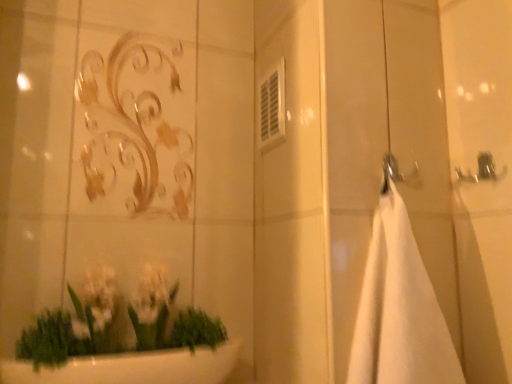
Question: Is white glossy plant at lower left turned away from white matte towel at right?

Choices:
 (A) no
 (B) yes

Answer: (A)

Question: Is there a large distance between white glossy plant at lower left and white matte towel at right?

Choices:
 (A) no
 (B) yes

Answer: (A)

Question: Does white glossy plant at lower left have a smaller size compared to white matte towel at right?

Choices:
 (A) no
 (B) yes

Answer: (A)

Question: Is white glossy plant at lower left further to the viewer compared to white matte towel at right?

Choices:
 (A) yes
 (B) no

Answer: (A)

Question: Is white glossy plant at lower left positioned before white matte towel at right?

Choices:
 (A) no
 (B) yes

Answer: (A)

Question: Is white glossy plant at lower left to the right of white matte towel at right from the viewer's perspective?

Choices:
 (A) yes
 (B) no

Answer: (B)

Question: Is white matte towel at right oriented towards white glossy plant at lower left?

Choices:
 (A) no
 (B) yes

Answer: (A)

Question: Considering the relative sizes of white matte towel at right and white glossy plant at lower left in the image provided, is white matte towel at right bigger than white glossy plant at lower left?

Choices:
 (A) no
 (B) yes

Answer: (A)

Question: Is white matte towel at right oriented away from white glossy plant at lower left?

Choices:
 (A) yes
 (B) no

Answer: (B)

Question: From a real-world perspective, does white matte towel at right sit lower than white glossy plant at lower left?

Choices:
 (A) no
 (B) yes

Answer: (A)

Question: Considering the relative sizes of white matte towel at right and white glossy plant at lower left in the image provided, is white matte towel at right shorter than white glossy plant at lower left?

Choices:
 (A) yes
 (B) no

Answer: (B)

Question: Does white matte towel at right lie in front of white glossy plant at lower left?

Choices:
 (A) yes
 (B) no

Answer: (A)

Question: Relative to white glossy plant at lower left, is white matte towel at right in front or behind?

Choices:
 (A) behind
 (B) front

Answer: (B)